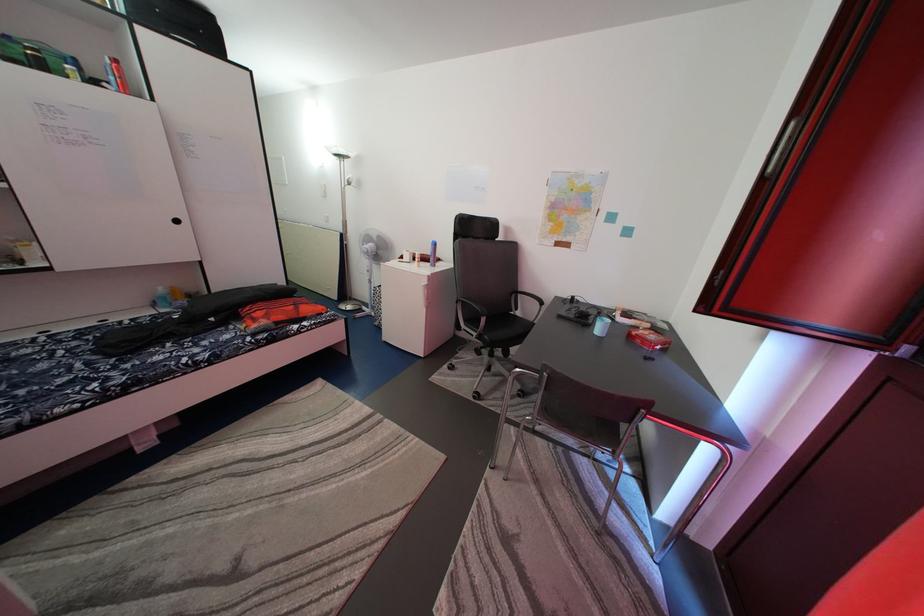
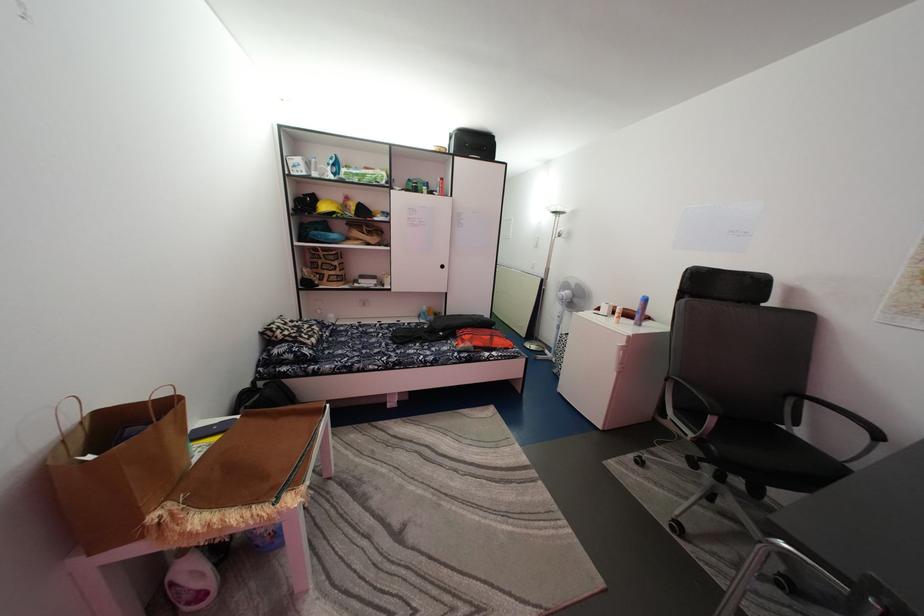
The point at (191, 309) is marked in the first image. Where is the corresponding point in the second image?

(440, 325)